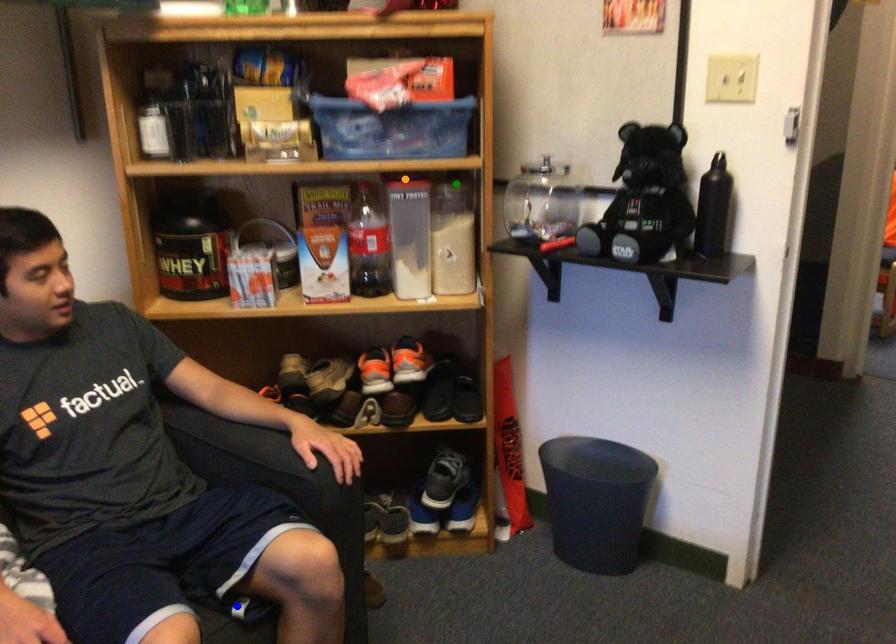
Order these from nearest to farthest:
green point, blue point, orange point

1. orange point
2. green point
3. blue point